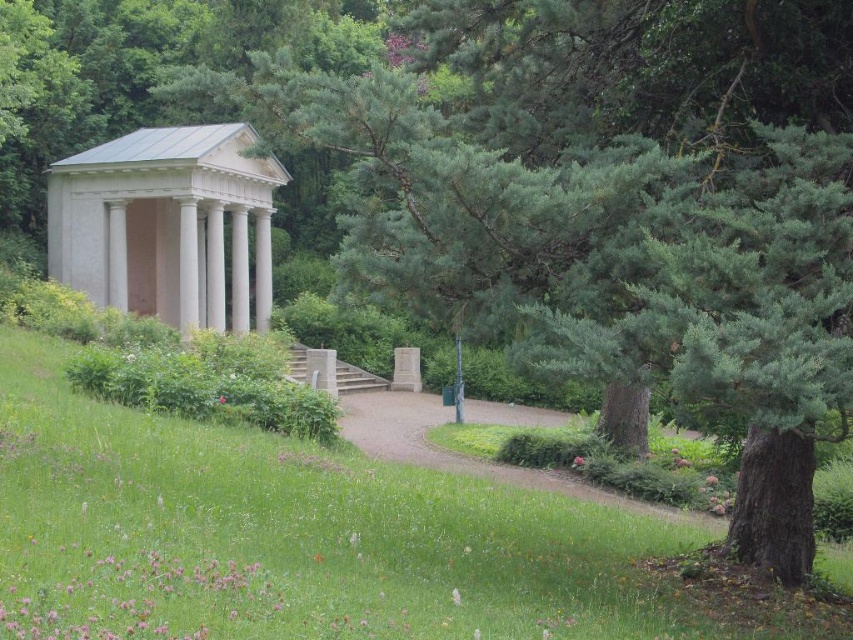
You are planning to organize a picnic in the park and have a large blanket that can cover the green grassy at lower left and the gravel path at center. Based on the scene description, will the blanket be sufficient to cover both areas?

The green grassy at lower left is larger in size than gravel path at center, so the blanket might not be sufficient to cover both areas if it is only sized for the larger green grassy at lower left.